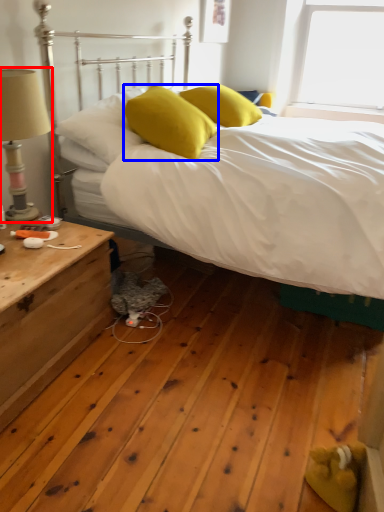
Question: Which object is closer to the camera taking this photo, table lamp (highlighted by a red box) or pillow (highlighted by a blue box)?

Choices:
 (A) table lamp
 (B) pillow

Answer: (A)